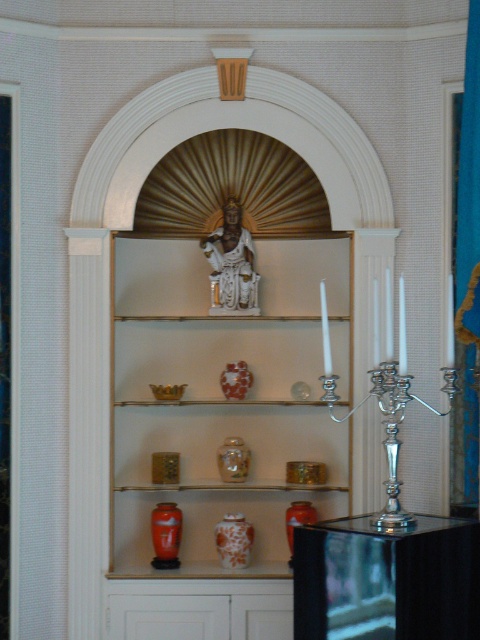
Question: Is the position of silver metallic candelabra at right more distant than that of white marble statue at center?

Choices:
 (A) no
 (B) yes

Answer: (A)

Question: Which point is closer to the camera taking this photo?

Choices:
 (A) (158, 541)
 (B) (242, 467)
 (C) (149, 358)
 (D) (226, 212)

Answer: (A)

Question: Does orange glazed vase at center have a smaller size compared to porcelain vase at center?

Choices:
 (A) yes
 (B) no

Answer: (B)

Question: Which of the following is the farthest from the observer?

Choices:
 (A) white marble statue at center
 (B) porcelain vase at center
 (C) orange glossy vase at center
 (D) white glossy statue at upper center

Answer: (A)

Question: Which object is positioned closest to the orange glazed vase at center?

Choices:
 (A) white glossy statue at upper center
 (B) orange glossy vase at center
 (C) silver metallic candelabra at right

Answer: (A)

Question: Does silver metallic candelabra at right have a lesser width compared to orange glossy vase at center?

Choices:
 (A) no
 (B) yes

Answer: (A)